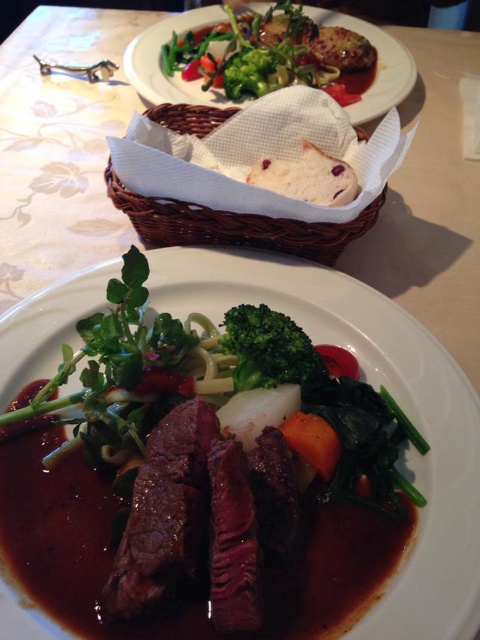
Question: Does green leafy vegetable at center have a lesser width compared to dark brown seared steak at center?

Choices:
 (A) no
 (B) yes

Answer: (A)

Question: Among these objects, which one is nearest to the camera?

Choices:
 (A) green leafy salad at upper center
 (B) dark brown seared steak at center
 (C) woven brown basket at upper center

Answer: (B)

Question: Among these objects, which one is farthest from the camera?

Choices:
 (A) green matte broccoli at center
 (B) savory brown steak at center

Answer: (A)

Question: Observing the image, what is the correct spatial positioning of savory brown steak at center in reference to orange smooth carrot at center?

Choices:
 (A) below
 (B) above

Answer: (B)

Question: Is green leafy salad at upper center positioned at the back of green matte broccoli at center?

Choices:
 (A) yes
 (B) no

Answer: (A)

Question: Among these objects, which one is nearest to the camera?

Choices:
 (A) green leafy vegetable at center
 (B) woven brown basket at upper center
 (C) savory brown steak at center

Answer: (C)